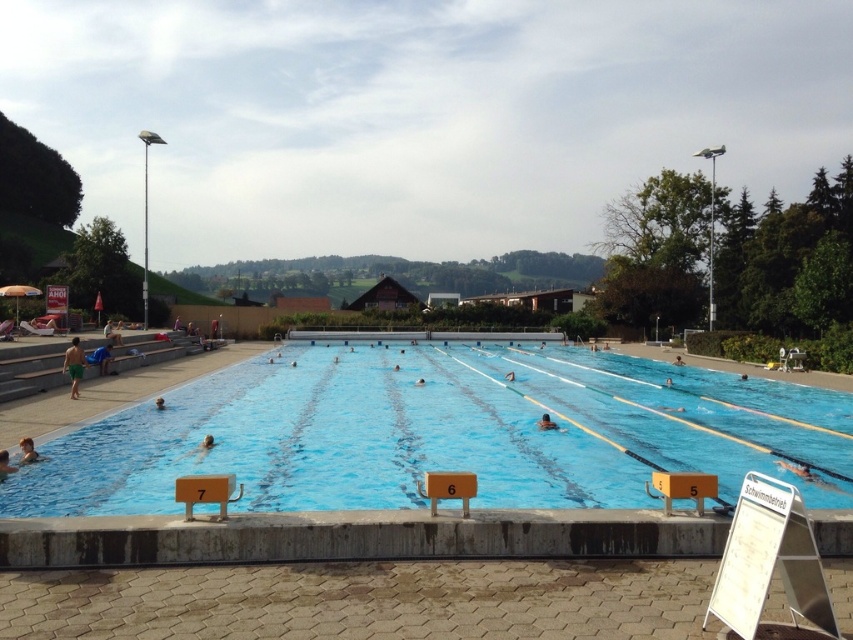
Question: Can you confirm if brown hair at upper center is wider than smooth blue swimmer at center?

Choices:
 (A) no
 (B) yes

Answer: (A)

Question: Where is light blue fabric towel at left located in relation to smooth skin swimmer at center in the image?

Choices:
 (A) left
 (B) right

Answer: (A)

Question: Does light blue skin at center have a smaller size compared to light blue fabric towel at left?

Choices:
 (A) no
 (B) yes

Answer: (B)

Question: Which object is positioned closest to the blue smooth water at center?

Choices:
 (A) smooth skin swimmer at center
 (B) light blue fabric towel at left
 (C) light blue skin at center
 (D) white matte person at center

Answer: (A)

Question: Which of these objects is positioned farthest from the smooth skin swimmer at center?

Choices:
 (A) light blue fabric towel at left
 (B) brown hair at upper center

Answer: (A)

Question: Which of the following is the farthest from the observer?

Choices:
 (A) (67, 356)
 (B) (421, 381)

Answer: (B)